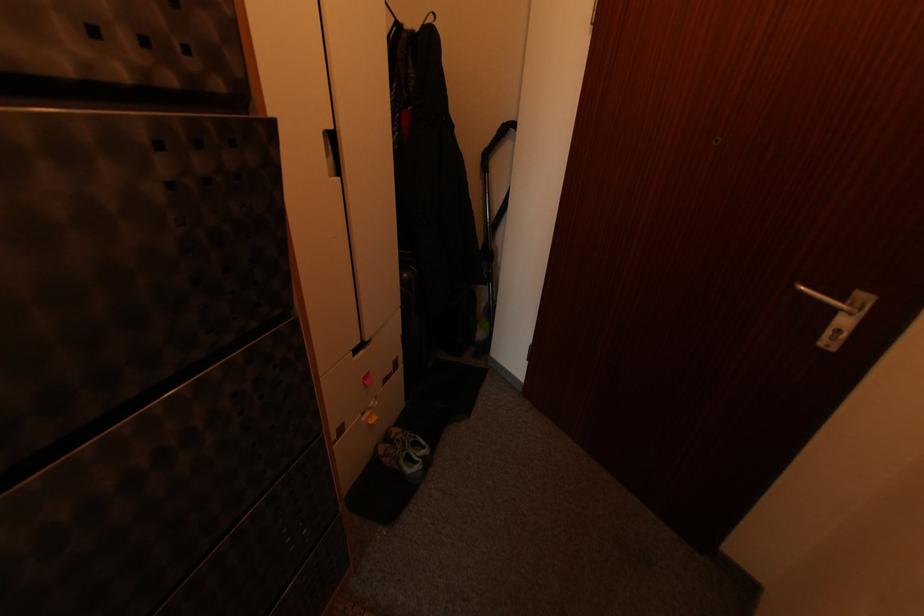
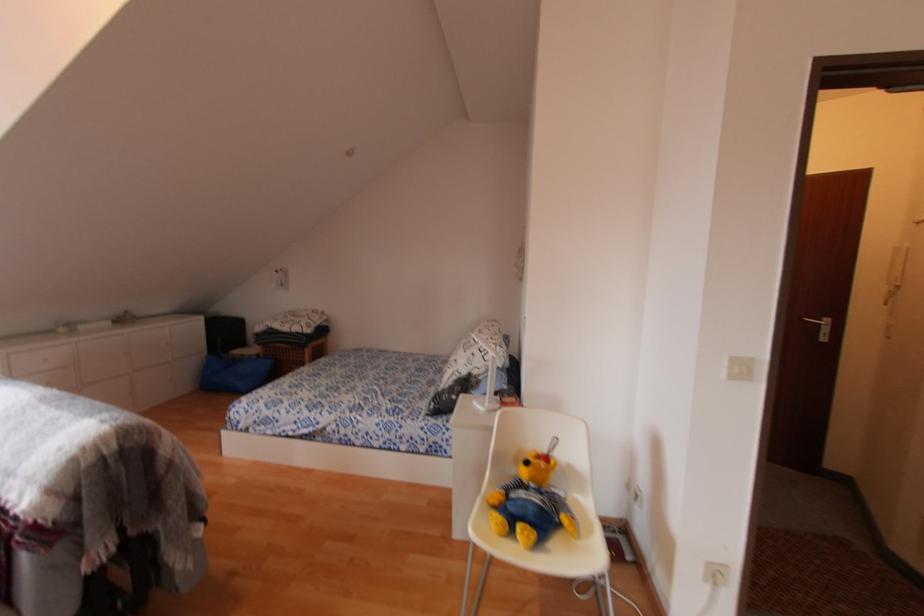
In the second image, find the point that corresponds to point (866, 299) in the first image.

(828, 321)